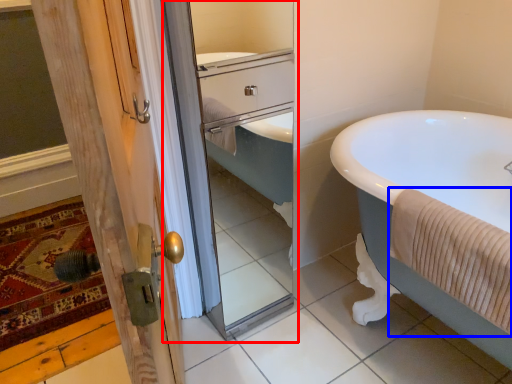
Question: Which object is further to the camera taking this photo, screen door (highlighted by a red box) or bath towel (highlighted by a blue box)?

Choices:
 (A) screen door
 (B) bath towel

Answer: (A)